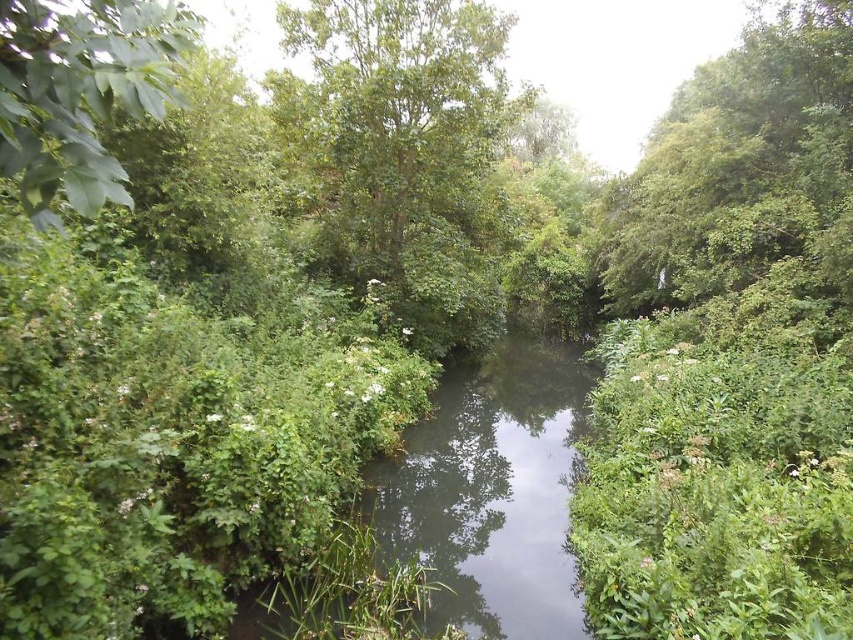
You are a bird flying over the serene natural scene. You see the green leafy tree at center and the clear water at center. Which one is closer to you?

The green leafy tree at center is closer to you because the clear water at center is behind it.

You are standing at the edge of the waterway in the image. If you want to reach the green leafy tree at center, in which direction should you move relative to your current position?

The green leafy tree at center is located at coordinates 0.234 on the x and 0.478 on the y axis. Since you are at the edge of the waterway, you should move towards the center of the scene to reach it.

You are a drone operator trying to capture a photo of the serene natural scene. You need to fly your drone from point A to point B. Point A is at point [505,440] and point B is at point [154,76]. According to the image, which point is closer to the drone when it is at the starting position?

Point [505,440] is further to the viewer than point [154,76], so when the drone is at the starting position, point [154,76] is closer to the drone.